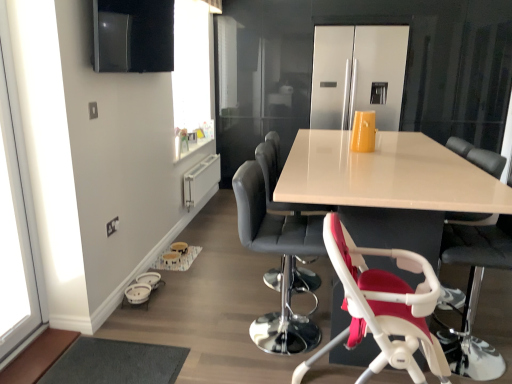
Question: From the image's perspective, relative to transparent glass window at left, is white plastic highchair at lower right, which ranks as the second chair in front-to-back order, above or below?

Choices:
 (A) below
 (B) above

Answer: (A)

Question: Is white plastic highchair at lower right, which ranks as the second chair in front-to-back order, taller or shorter than transparent glass window at left?

Choices:
 (A) short
 (B) tall

Answer: (A)

Question: Based on their relative distances, which object is nearer to the white glossy table at center?

Choices:
 (A) white plastic highchair at lower right, which ranks as the second chair in front-to-back order
 (B) stainless steel refrigerator at center
 (C) white plastic baby carriage at lower left
 (D) transparent glass window at left
 (E) black leather bar stool at center, marked as the 2th chair in a back-to-front arrangement

Answer: (E)

Question: Based on their relative distances, which object is nearer to the white plastic baby carriage at lower left?

Choices:
 (A) white plastic highchair at lower right, which is the 1th chair in front-to-back order
 (B) leather-like black chair at center, which is the 1th chair from back to front
 (C) black leather bar stool at center, marked as the 2th chair in a back-to-front arrangement
 (D) white glossy table at center
 (E) white plastic highchair at lower right, the 3th chair from the back

Answer: (C)